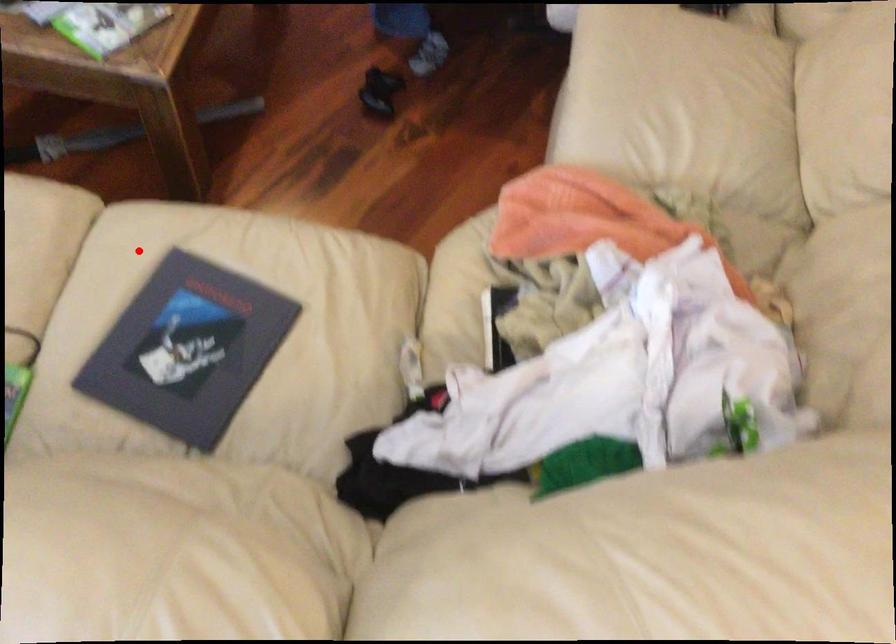
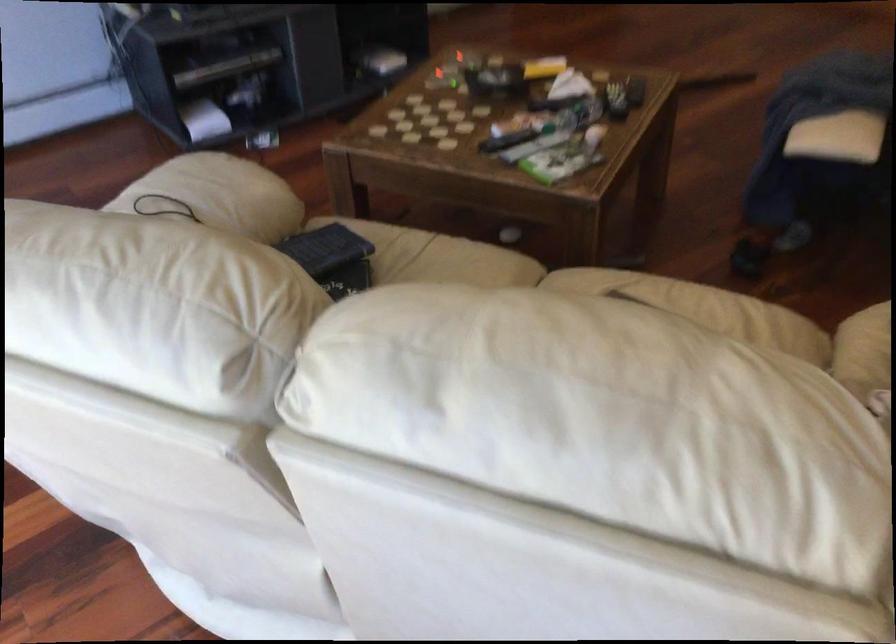
Question: I am providing you with two images of the same scene from different viewpoints. Image1 has a red point marked. In image2, the corresponding 3D location appears at what relative position? Reply with the corresponding letter.

Choices:
 (A) Closer
 (B) Farther

Answer: (B)